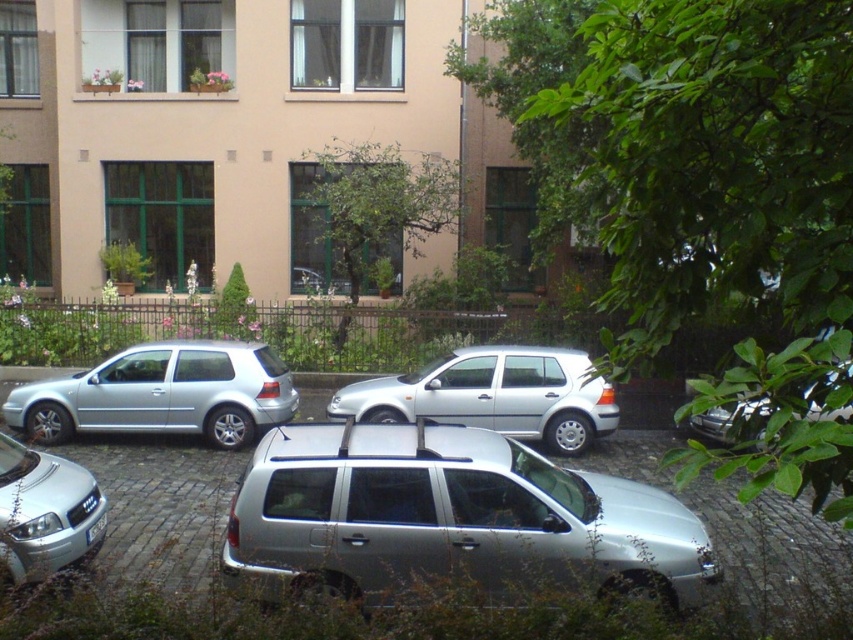
Question: Among these objects, which one is farthest from the camera?

Choices:
 (A) silver metallic sedan at lower left
 (B) silver metallic hatchback at center-left
 (C) satin silver suv at center

Answer: (B)

Question: Does satin silver suv at center have a greater width compared to silver metallic hatchback at center-left?

Choices:
 (A) yes
 (B) no

Answer: (B)

Question: Which of the following is the farthest from the observer?

Choices:
 (A) (55, 468)
 (B) (225, 548)

Answer: (A)

Question: Which object is farther from the camera taking this photo?

Choices:
 (A) satin silver suv at center
 (B) silver metallic sedan at lower left
 (C) silver metallic hatchback at center-left

Answer: (C)

Question: Does satin silver suv at center have a lesser width compared to silver metallic hatchback at center-left?

Choices:
 (A) no
 (B) yes

Answer: (B)

Question: Is silver metallic sedan at lower left to the left of metallic silver car at right from the viewer's perspective?

Choices:
 (A) no
 (B) yes

Answer: (B)